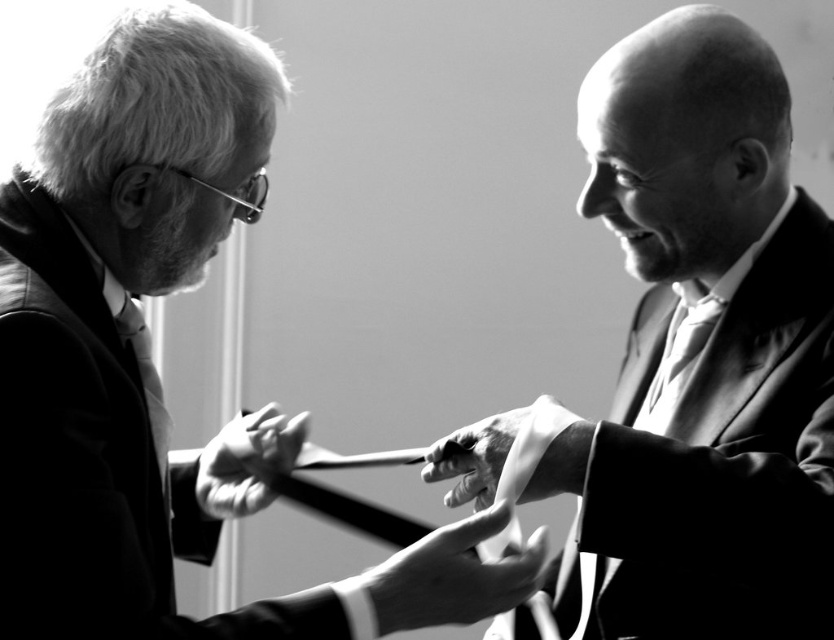
You are a photographer adjusting the lighting for a photo shoot. You notice the matte black suit at left and the silky white tie at center in your frame. Which object should you focus on first if you want to ensure proper exposure for the closest subject?

The matte black suit at left is in front of the silky white tie at center, so you should focus on the matte black suit at left first to ensure proper exposure for the closest subject.

You are a photographer at a formal event. You need to position a camera on a tripod to capture both the matte black suit at left and the silky white tie at center in the frame. Considering their height difference, which object should you adjust the tripod height to focus on first?

The matte black suit at left is much taller than the silky white tie at center. To ensure both are in frame, adjust the tripod height to focus on the matte black suit at left first, then adjust downward for the silky white tie at center.

You are a photographer at a wedding ceremony. You need to capture a photo where the smooth fabric tie at center and the matte black suit at left are clearly visible. Based on their positions, which object is higher in the frame?

The smooth fabric tie at center is above the matte black suit at left, so it is higher in the frame.